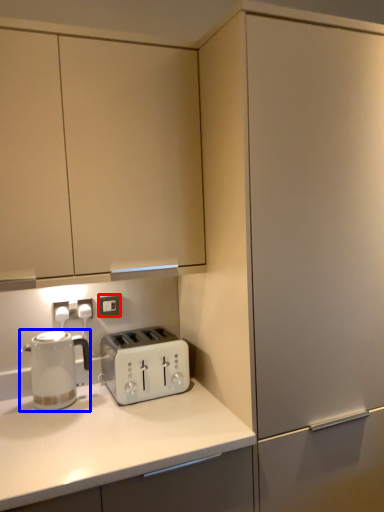
Question: Which object is closer to the camera taking this photo, electric outlet (highlighted by a red box) or home appliance (highlighted by a blue box)?

Choices:
 (A) electric outlet
 (B) home appliance

Answer: (B)